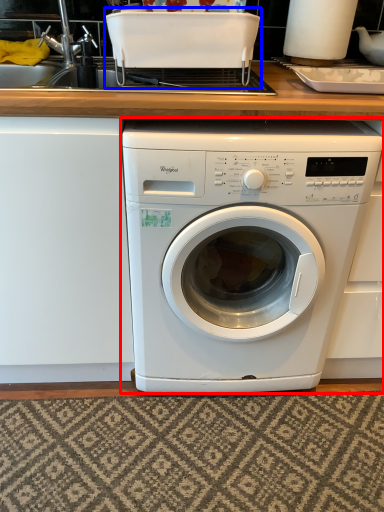
Question: Among these objects, which one is nearest to the camera, washing machine (highlighted by a red box) or appliance (highlighted by a blue box)?

Choices:
 (A) washing machine
 (B) appliance

Answer: (A)